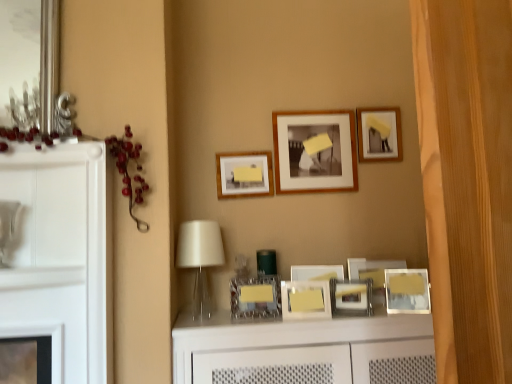
Question: Is wooden picture frame at upper right, placed as the 8th picture frame when sorted from bottom to top, facing away from translucent glass table lamp at center?

Choices:
 (A) no
 (B) yes

Answer: (A)

Question: Is wooden picture frame at upper right, acting as the first picture frame starting from the top, behind translucent glass table lamp at center?

Choices:
 (A) yes
 (B) no

Answer: (A)

Question: Does wooden picture frame at upper right, acting as the first picture frame starting from the top, have a lesser height compared to translucent glass table lamp at center?

Choices:
 (A) no
 (B) yes

Answer: (B)

Question: Is wooden picture frame at upper right, placed as the 8th picture frame when sorted from bottom to top, taller than translucent glass table lamp at center?

Choices:
 (A) no
 (B) yes

Answer: (A)

Question: Is wooden picture frame at upper right, acting as the first picture frame starting from the top, bigger than translucent glass table lamp at center?

Choices:
 (A) yes
 (B) no

Answer: (B)

Question: Which is correct: metallic silver picture frame at center, the eighth picture frame from the top, is inside translucent glass table lamp at center, or outside of it?

Choices:
 (A) outside
 (B) inside

Answer: (A)

Question: Is metallic silver picture frame at center, which is the 1th picture frame in bottom-to-top order, in front of or behind translucent glass table lamp at center in the image?

Choices:
 (A) behind
 (B) front

Answer: (A)

Question: Visually, is metallic silver picture frame at center, the eighth picture frame from the top, positioned to the left or to the right of translucent glass table lamp at center?

Choices:
 (A) left
 (B) right

Answer: (B)

Question: From the image's perspective, is metallic silver picture frame at center, the eighth picture frame from the top, positioned above or below translucent glass table lamp at center?

Choices:
 (A) below
 (B) above

Answer: (A)

Question: From their relative heights in the image, would you say metallic silver picture frame at lower right, the fifth picture frame from the bottom, is taller or shorter than metallic silver picture frame at center, which is the 1th picture frame in bottom-to-top order?

Choices:
 (A) tall
 (B) short

Answer: (A)

Question: From a real-world perspective, is metallic silver picture frame at lower right, the fifth picture frame from the bottom, above or below metallic silver picture frame at center, which is the 1th picture frame in bottom-to-top order?

Choices:
 (A) below
 (B) above

Answer: (B)

Question: Based on their positions, is metallic silver picture frame at lower right, the 4th picture frame in the top-to-bottom sequence, located to the left or right of metallic silver picture frame at center, which is the 1th picture frame in bottom-to-top order?

Choices:
 (A) right
 (B) left

Answer: (A)

Question: Do you think metallic silver picture frame at lower right, the 4th picture frame in the top-to-bottom sequence, is within metallic silver picture frame at center, the eighth picture frame from the top, or outside of it?

Choices:
 (A) outside
 (B) inside

Answer: (A)

Question: In terms of height, does metallic silver picture frame at center, the 5th picture frame in the top-to-bottom sequence, look taller or shorter compared to metallic silver picture frame at center, the second picture frame ordered from the bottom?

Choices:
 (A) short
 (B) tall

Answer: (B)

Question: Relative to metallic silver picture frame at center, placed as the 7th picture frame when sorted from top to bottom, is metallic silver picture frame at center, the 5th picture frame in the top-to-bottom sequence, in front or behind?

Choices:
 (A) front
 (B) behind

Answer: (B)